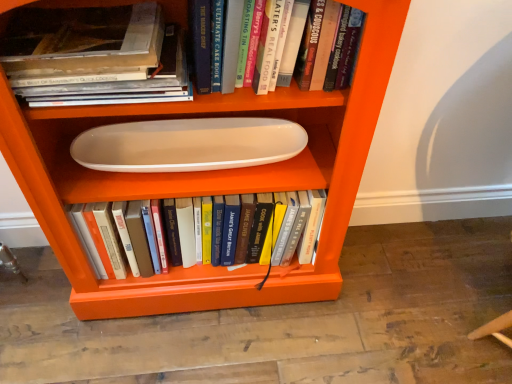
Find the location of a particular element. free spot in front of white glossy oval tray at center is located at coordinates (200, 351).